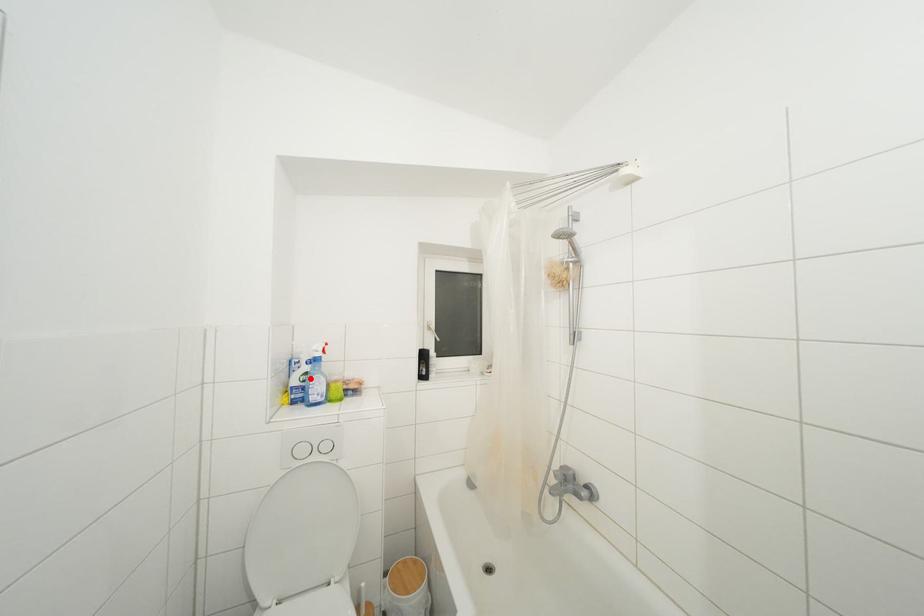
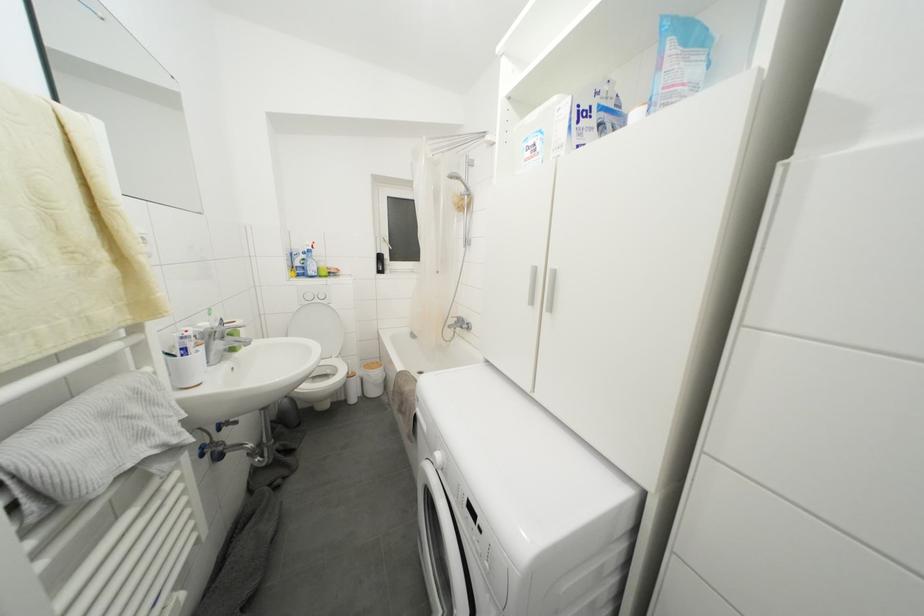
Locate, in the second image, the point that corresponds to the highlighted location in the first image.

(308, 264)